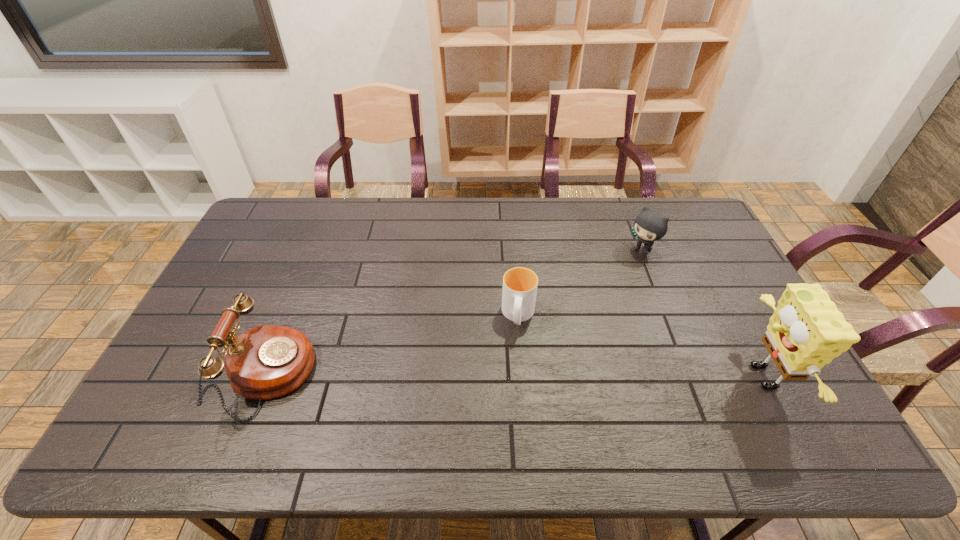
The width and height of the screenshot is (960, 540). I want to click on blank space located 0.230m on the front-facing side of the rightmost object, so click(650, 376).

Identify the location of vacant space located 0.090m on the front-facing side of the rightmost object. This screenshot has height=540, width=960. (704, 376).

At what (x,y) coordinates should I click in order to perform the action: click on vacant space located 0.230m with the handle on the side of the second object from left to right. Please return your answer as a coordinate pair (x, y). This screenshot has height=540, width=960. Looking at the image, I should click on (510, 410).

The height and width of the screenshot is (540, 960). Identify the location of free space located 0.070m with the handle on the side of the second object from left to right. (516, 356).

You are a GUI agent. You are given a task and a screenshot of the screen. Output one action in this format:
    pyautogui.click(x=<x>, y=<y>)
    Task: Click on the vacant space located 0.220m with the handle on the side of the second object from left to right
    
    Given the screenshot: What is the action you would take?
    pyautogui.click(x=511, y=406)

The height and width of the screenshot is (540, 960). In order to click on vacant region located on the front-facing side of the kitten in this screenshot , I will do `click(573, 303)`.

The width and height of the screenshot is (960, 540). In order to click on free location located on the front-facing side of the kitten in this screenshot , I will do `click(566, 308)`.

Find the location of `free space located on the front-facing side of the kitten`. free space located on the front-facing side of the kitten is located at coordinates (600, 283).

You are a GUI agent. You are given a task and a screenshot of the screen. Output one action in this format:
    pyautogui.click(x=<x>, y=<y>)
    Task: Click on the telephone situated at the near edge
    The image size is (960, 540).
    Given the screenshot: What is the action you would take?
    pyautogui.click(x=265, y=362)

Locate an element on the screen. This screenshot has width=960, height=540. sponge situated at the near edge is located at coordinates (806, 331).